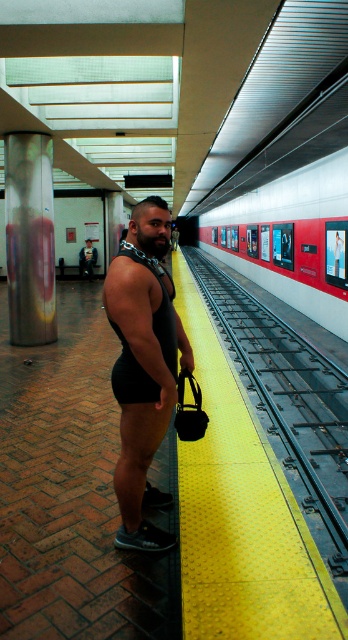
Which is below, metallic cylindrical pillar at left or matte black singlet at center?

metallic cylindrical pillar at left is below.

At what (x,y) coordinates should I click in order to perform the action: click on metallic cylindrical pillar at left. Please return your answer as a coordinate pair (x, y). Image resolution: width=348 pixels, height=640 pixels. Looking at the image, I should click on (29, 237).

Can you confirm if black matte singlet at center is taller than smooth glossy train at center?

No, black matte singlet at center is not taller than smooth glossy train at center.

In the scene shown: Between black matte singlet at center and smooth glossy train at center, which one appears on the right side from the viewer's perspective?

From the viewer's perspective, smooth glossy train at center appears more on the right side.

Which is in front, point (163, 426) or point (262, 220)?

Positioned in front is point (163, 426).

I want to click on black matte singlet at center, so click(144, 365).

Between smooth glossy train at center and matte black singlet at center, which one has more height?

Standing taller between the two is smooth glossy train at center.

The width and height of the screenshot is (348, 640). What do you see at coordinates (290, 237) in the screenshot?
I see `smooth glossy train at center` at bounding box center [290, 237].

This screenshot has width=348, height=640. Identify the location of smooth glossy train at center. (290, 237).